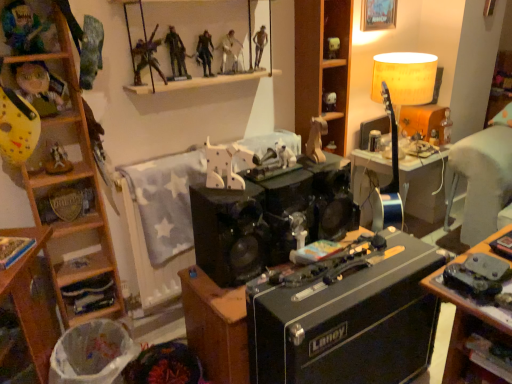
Question: Can you confirm if white plastic trash bin at lower left is positioned to the right of matte yellow lampshade at upper right?

Choices:
 (A) yes
 (B) no

Answer: (B)

Question: Considering the relative positions of white plastic trash bin at lower left and matte yellow lampshade at upper right in the image provided, is white plastic trash bin at lower left in front of matte yellow lampshade at upper right?

Choices:
 (A) yes
 (B) no

Answer: (A)

Question: Does white plastic trash bin at lower left appear on the left side of matte yellow lampshade at upper right?

Choices:
 (A) yes
 (B) no

Answer: (A)

Question: Is white plastic trash bin at lower left facing away from matte yellow lampshade at upper right?

Choices:
 (A) yes
 (B) no

Answer: (B)

Question: Are white plastic trash bin at lower left and matte yellow lampshade at upper right beside each other?

Choices:
 (A) yes
 (B) no

Answer: (B)

Question: Which is correct: matte plastic action figure at upper center, arranged as the 2th toy when viewed from the right, is inside white matte dog at center, which appears as the third toy when viewed from the back, or outside of it?

Choices:
 (A) inside
 (B) outside

Answer: (B)

Question: Visually, is matte plastic action figure at upper center, which is the first toy from top to bottom, positioned to the left or to the right of white matte dog at center, which is the 3th toy from front to back?

Choices:
 (A) left
 (B) right

Answer: (B)

Question: From the image's perspective, is matte plastic action figure at upper center, which is counted as the fifth toy, starting from the bottom, located above or below white matte dog at center, which appears as the third toy when viewed from the back?

Choices:
 (A) below
 (B) above

Answer: (B)

Question: Considering the positions of matte plastic action figure at upper center, the 2th toy viewed from the back, and white matte dog at center, which ranks as the third toy in right-to-left order, in the image, is matte plastic action figure at upper center, the 2th toy viewed from the back, bigger or smaller than white matte dog at center, which ranks as the third toy in right-to-left order,?

Choices:
 (A) small
 (B) big

Answer: (A)

Question: In terms of width, does matte yellow lampshade at upper right look wider or thinner when compared to wooden cabinet at left?

Choices:
 (A) wide
 (B) thin

Answer: (A)

Question: From a real-world perspective, relative to wooden cabinet at left, is matte yellow lampshade at upper right vertically above or below?

Choices:
 (A) below
 (B) above

Answer: (B)

Question: Which is correct: matte yellow lampshade at upper right is inside wooden cabinet at left, or outside of it?

Choices:
 (A) inside
 (B) outside

Answer: (B)

Question: In terms of size, does matte yellow lampshade at upper right appear bigger or smaller than wooden cabinet at left?

Choices:
 (A) small
 (B) big

Answer: (B)

Question: From the image's perspective, is matte yellow lampshade at upper right positioned above or below smooth white figure at upper center, which is the 6th person in left-to-right order?

Choices:
 (A) below
 (B) above

Answer: (A)

Question: In terms of height, does matte yellow lampshade at upper right look taller or shorter compared to smooth white figure at upper center, which is the 2th person from right to left?

Choices:
 (A) tall
 (B) short

Answer: (A)